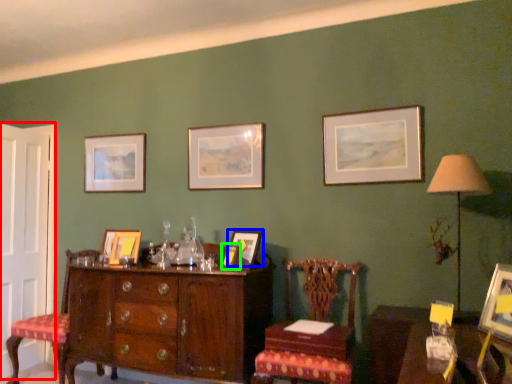
Question: Considering the real-world distances, which object is farthest from door (highlighted by a red box)? picture frame (highlighted by a blue box) or picture frame (highlighted by a green box)?

Choices:
 (A) picture frame
 (B) picture frame

Answer: (A)